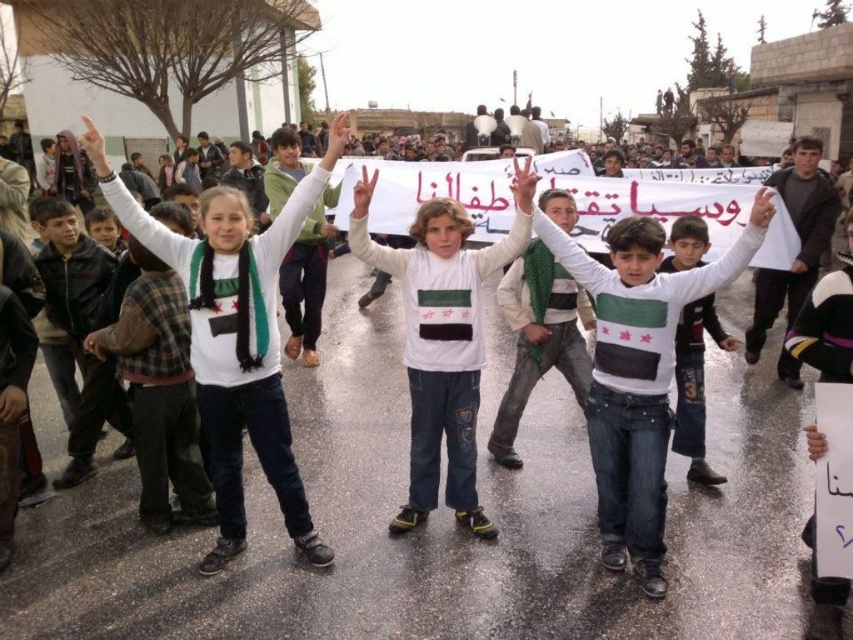
Question: Observing the image, what is the correct spatial positioning of white cotton shirt at center in reference to white sweater at center?

Choices:
 (A) below
 (B) above

Answer: (B)

Question: Which point is farther from the camera taking this photo?

Choices:
 (A) (534, 212)
 (B) (724, 342)

Answer: (B)

Question: Which point is closer to the camera?

Choices:
 (A) (616, 269)
 (B) (735, 346)

Answer: (A)

Question: Is white cotton shirt at center positioned before white sweater at center?

Choices:
 (A) yes
 (B) no

Answer: (A)

Question: Which point is farther from the camera taking this photo?

Choices:
 (A) (700, 468)
 (B) (666, 394)

Answer: (A)

Question: Is white cotton shirt at center smaller than white sweater at center?

Choices:
 (A) yes
 (B) no

Answer: (B)